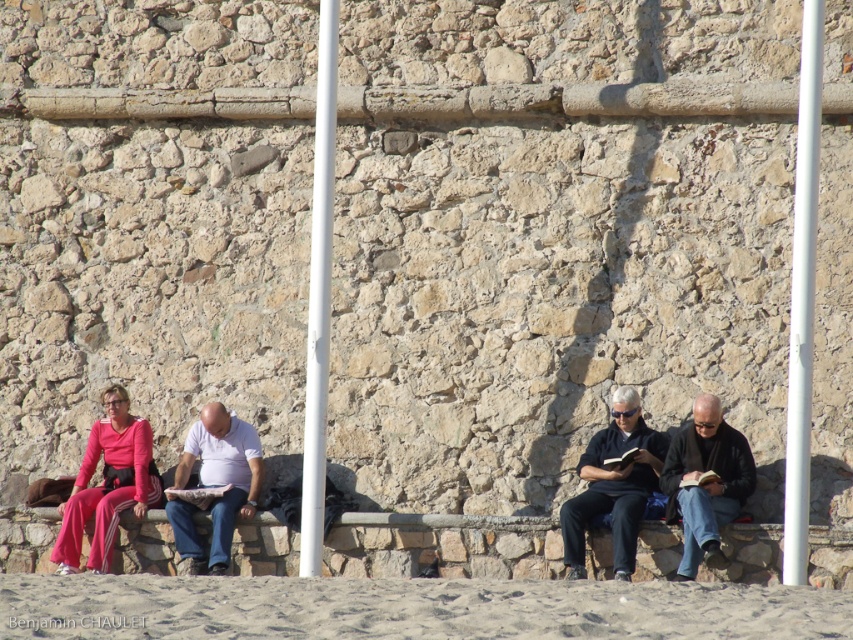
Who is more forward, (421, 627) or (798, 470)?

Positioned in front is point (421, 627).

Does point (840, 612) come in front of point (788, 570)?

Yes, it is in front of point (788, 570).

Based on the photo, who is more forward, (589, 600) or (791, 317)?

Point (589, 600) is in front.

Where is `fine-grained sand at lower center`? The height and width of the screenshot is (640, 853). fine-grained sand at lower center is located at coordinates (408, 608).

Is dark blue shirt at center below hardcover book at center?

Correct, dark blue shirt at center is located below hardcover book at center.

Which is behind, point (639, 461) or point (635, 451)?

The point (639, 461) is more distant.

Identify the location of dark blue shirt at center. This screenshot has height=640, width=853. (613, 484).

Between dark gray leather jacket at lower right and white matte shirt at center, which one appears on the right side from the viewer's perspective?

dark gray leather jacket at lower right is more to the right.

Does dark gray leather jacket at lower right come behind white matte shirt at center?

No.

Is point (735, 452) positioned before point (213, 563)?

Yes, point (735, 452) is closer to viewer.

I want to click on dark gray leather jacket at lower right, so click(705, 483).